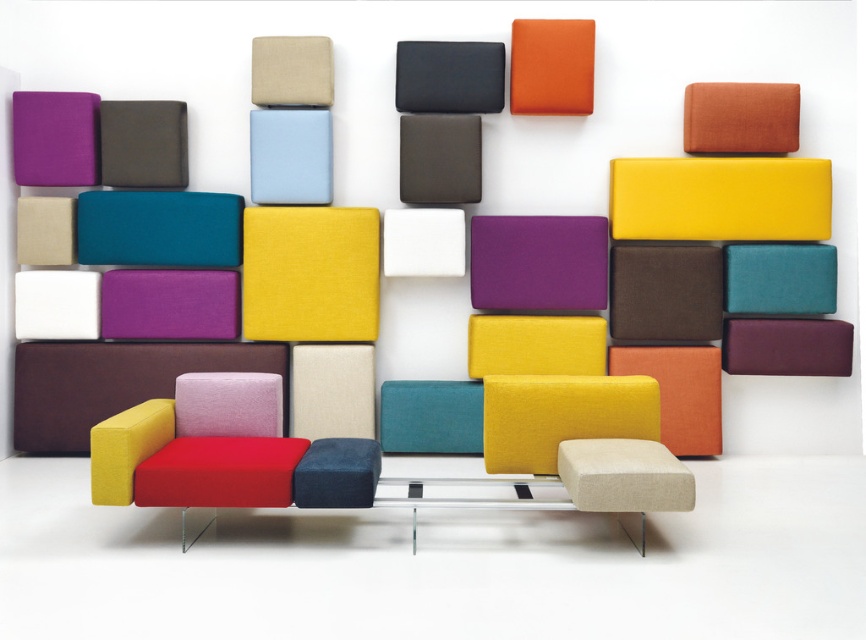
Who is positioned more to the left, yellow matte rectangular cushion at upper right or matte purple cushion at right?

yellow matte rectangular cushion at upper right is more to the left.

Locate an element on the screen. The height and width of the screenshot is (640, 866). yellow matte rectangular cushion at upper right is located at coordinates (721, 198).

Does point (813, 180) come behind point (721, 356)?

No, it is in front of (721, 356).

Where is `yellow matte rectangular cushion at upper right`? This screenshot has width=866, height=640. yellow matte rectangular cushion at upper right is located at coordinates (721, 198).

Who is more forward, (x=157, y=104) or (x=78, y=320)?

Point (x=157, y=104) is in front.

Who is higher up, matte gray cushion at upper left or white matte rectangle at lower left?

matte gray cushion at upper left is higher up.

Between point (162, 100) and point (37, 324), which one is positioned in front?

Positioned in front is point (162, 100).

Identify the location of matte gray cushion at upper left. The image size is (866, 640). (143, 144).

Between point (111, 160) and point (838, 337), which one is positioned in front?

Positioned in front is point (838, 337).

Does matte gray cushion at upper left appear on the left side of matte purple cushion at right?

Correct, you'll find matte gray cushion at upper left to the left of matte purple cushion at right.

Who is more distant from viewer, (157, 109) or (789, 365)?

The point (789, 365) is behind.

Find the location of a particular element. This screenshot has width=866, height=640. matte gray cushion at upper left is located at coordinates (143, 144).